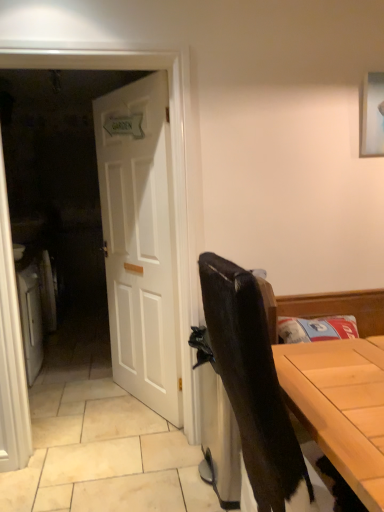
Where is `vacant space situated on the left part of white wooden door at center`? This screenshot has width=384, height=512. vacant space situated on the left part of white wooden door at center is located at coordinates (91, 404).